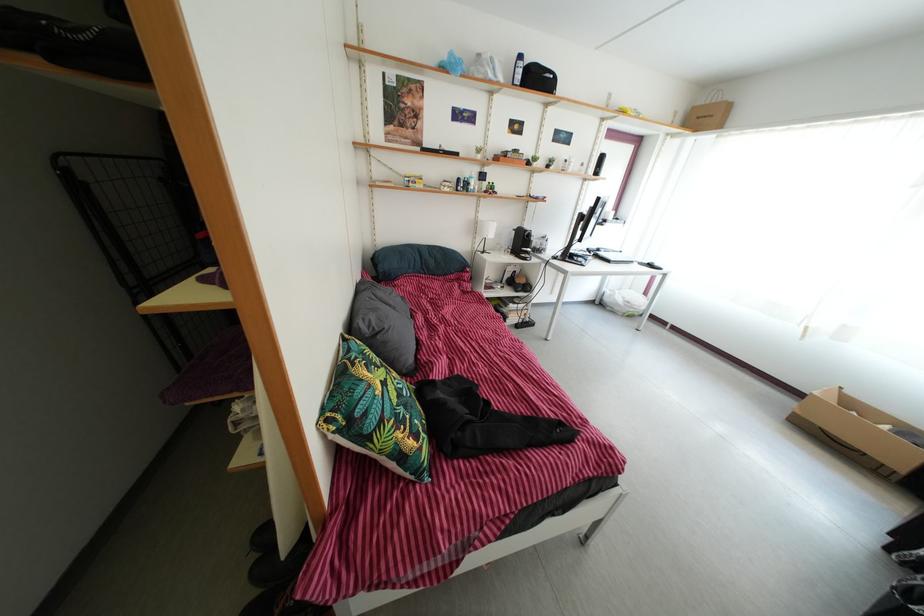
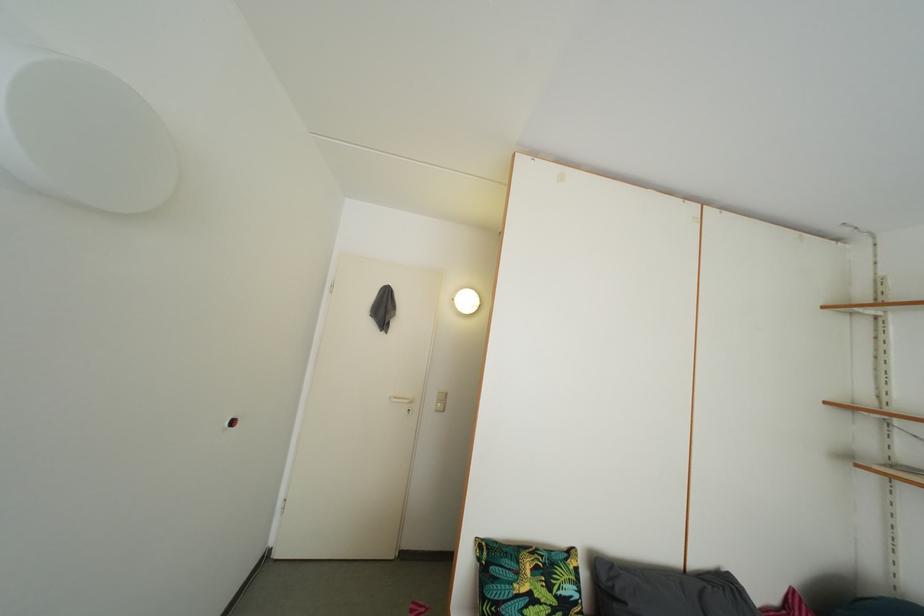
Question: The camera is either moving clockwise (left) or counter-clockwise (right) around the object. The first image is from the beginning of the video and the second image is from the end. Is the camera moving left or right when shooting the video?

Choices:
 (A) Left
 (B) Right

Answer: (B)